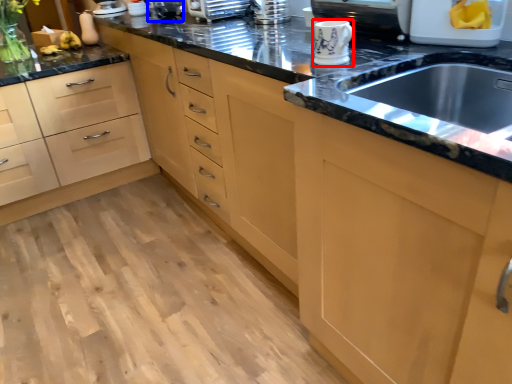
Question: Among these objects, which one is farthest to the camera, appliance (highlighted by a red box) or appliance (highlighted by a blue box)?

Choices:
 (A) appliance
 (B) appliance

Answer: (B)